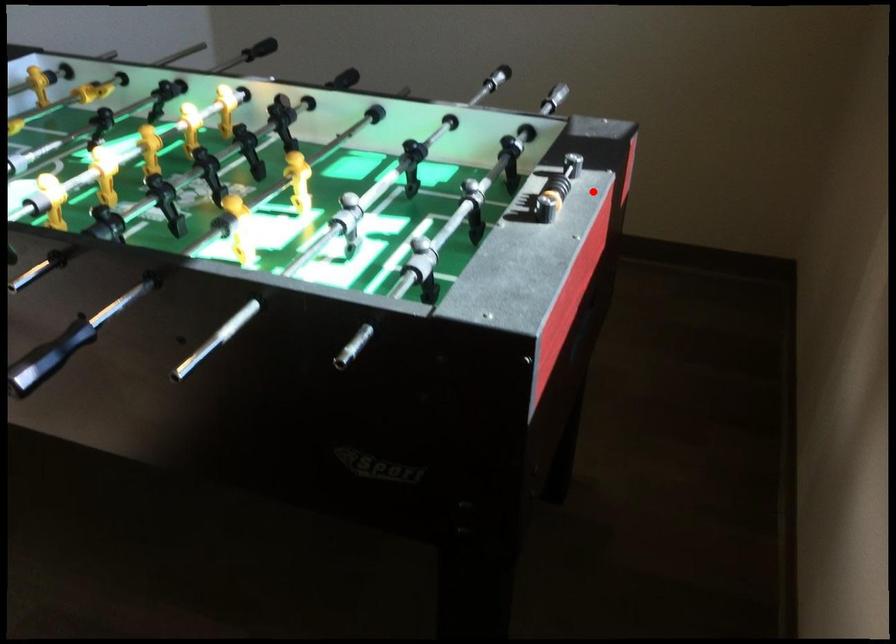
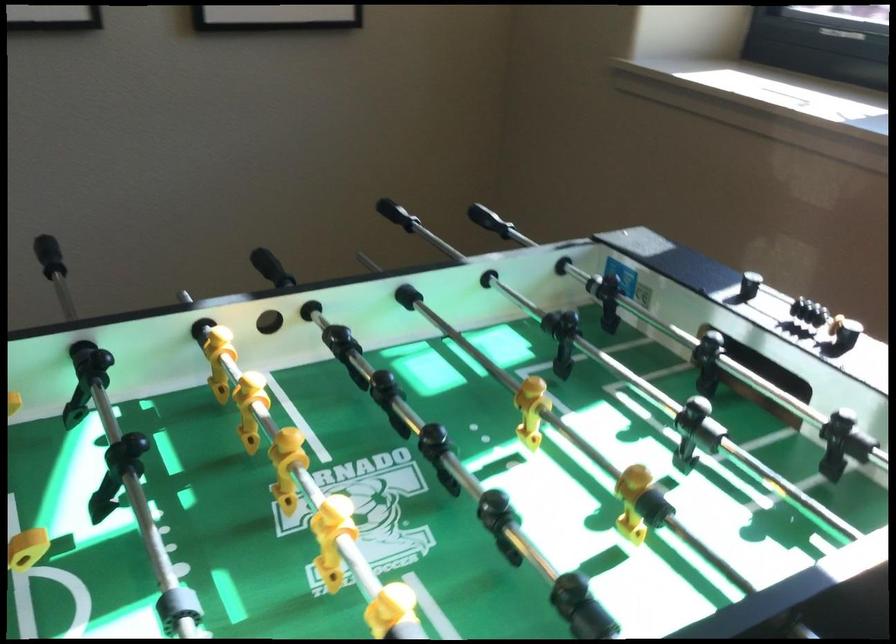
The point at the highlighted location is marked in the first image. Where is the corresponding point in the second image?

(798, 307)